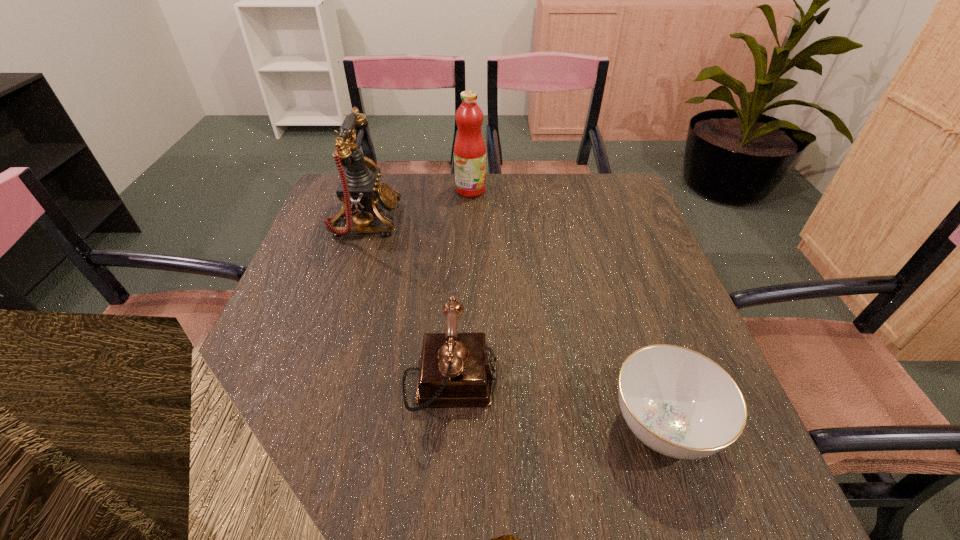
The width and height of the screenshot is (960, 540). Identify the location of blank area in the image that satisfies the following two spatial constraints: 1. on the dial of the shorter telephone; 2. on the left side of the rightmost object. (448, 427).

Locate an element on the screen. The height and width of the screenshot is (540, 960). free point that satisfies the following two spatial constraints: 1. on the dial of the rightmost object; 2. on the right side of the nearer telephone is located at coordinates tap(448, 427).

The height and width of the screenshot is (540, 960). I want to click on vacant region that satisfies the following two spatial constraints: 1. on the dial of the nearer telephone; 2. on the back side of the shortest object, so click(x=448, y=427).